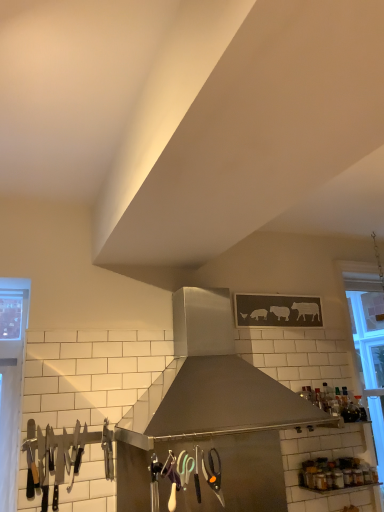
Question: Considering the relative sizes of clear glass window at right and transparent glass bottle at upper right in the image provided, is clear glass window at right smaller than transparent glass bottle at upper right?

Choices:
 (A) yes
 (B) no

Answer: (B)

Question: From a real-world perspective, is clear glass window at right below transparent glass bottle at upper right?

Choices:
 (A) yes
 (B) no

Answer: (B)

Question: Is clear glass window at right positioned with its back to transparent glass bottle at upper right?

Choices:
 (A) no
 (B) yes

Answer: (A)

Question: Is clear glass window at right far away from transparent glass bottle at upper right?

Choices:
 (A) yes
 (B) no

Answer: (B)

Question: Does clear glass window at right have a lesser width compared to transparent glass bottle at upper right?

Choices:
 (A) yes
 (B) no

Answer: (B)

Question: From the image's perspective, is clear glass window at right located beneath transparent glass bottle at upper right?

Choices:
 (A) yes
 (B) no

Answer: (B)

Question: From a real-world perspective, is clear glass window at right under polished stainless steel knives at left?

Choices:
 (A) no
 (B) yes

Answer: (A)

Question: Considering the relative sizes of clear glass window at right and polished stainless steel knives at left in the image provided, is clear glass window at right taller than polished stainless steel knives at left?

Choices:
 (A) yes
 (B) no

Answer: (A)

Question: Is clear glass window at right positioned before polished stainless steel knives at left?

Choices:
 (A) yes
 (B) no

Answer: (B)

Question: Is the surface of clear glass window at right in direct contact with polished stainless steel knives at left?

Choices:
 (A) no
 (B) yes

Answer: (A)

Question: Is polished stainless steel knives at left located within clear glass window at right?

Choices:
 (A) yes
 (B) no

Answer: (B)

Question: Could you tell me if clear glass window at right is facing polished stainless steel knives at left?

Choices:
 (A) no
 (B) yes

Answer: (A)

Question: Considering the relative sizes of stainless steel range hood at center and transparent glass bottle at upper right in the image provided, is stainless steel range hood at center bigger than transparent glass bottle at upper right?

Choices:
 (A) no
 (B) yes

Answer: (B)